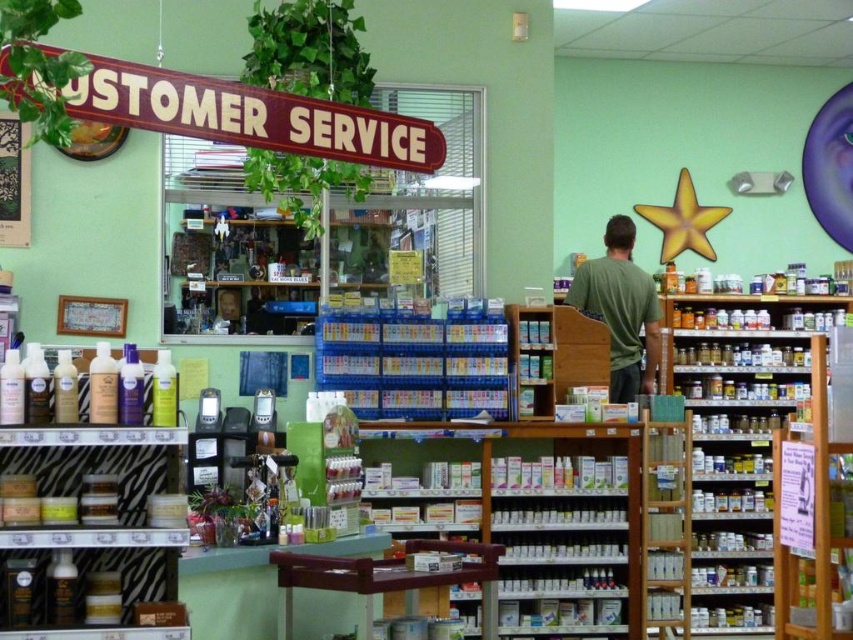
Question: Is wooden shelf at center closer to the viewer compared to wooden sign at upper left?

Choices:
 (A) no
 (B) yes

Answer: (A)

Question: Is zebra print containers at lower left smaller than white plastic bottles at center?

Choices:
 (A) yes
 (B) no

Answer: (A)

Question: Which object is the closest to the green matte t-shirt at center?

Choices:
 (A) wooden sign at upper left
 (B) zebra print containers at lower left
 (C) wooden shelf at center
 (D) wooden shelves at right

Answer: (C)

Question: Which is farther from the wooden shelf at center?

Choices:
 (A) wooden shelves at right
 (B) white plastic bottles at center
 (C) zebra print containers at lower left

Answer: (C)

Question: Is white plastic bottles at center thinner than green matte t-shirt at center?

Choices:
 (A) no
 (B) yes

Answer: (A)

Question: Which object is closer to the camera taking this photo?

Choices:
 (A) green matte t-shirt at center
 (B) zebra print containers at lower left

Answer: (B)